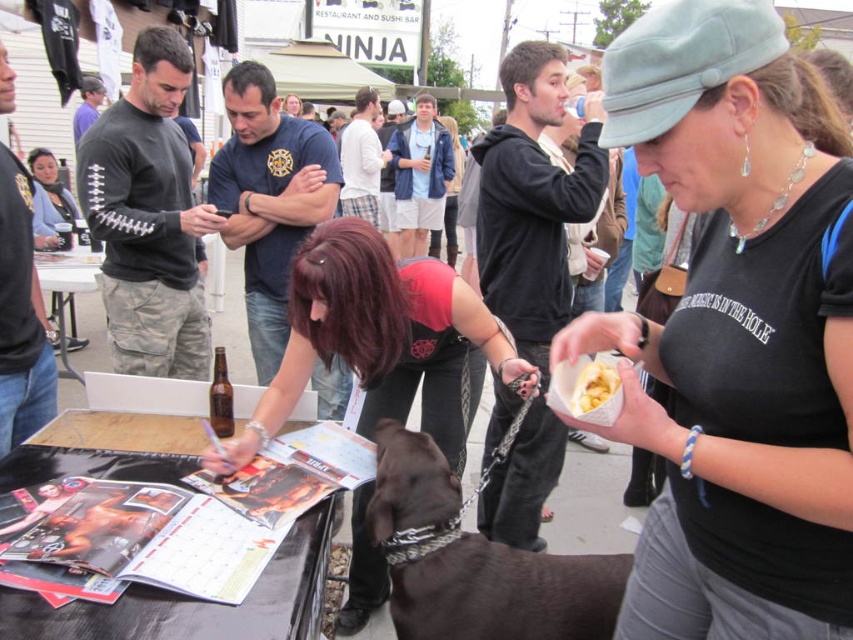
Which is in front, point (810, 182) or point (427, 312)?

Point (810, 182) is in front.

Which of these two, matte black shirt at center or shiny black shirt at center, stands taller?

shiny black shirt at center

Locate an element on the screen. matte black shirt at center is located at coordinates (737, 332).

Where is `matte black shirt at center`? The height and width of the screenshot is (640, 853). matte black shirt at center is located at coordinates (737, 332).

Between point (776, 404) and point (399, 436), which one is positioned in front?

Point (776, 404) is in front.

Is point (735, 413) positioned behind point (482, 600)?

No.

Where is `matte black shirt at center`? matte black shirt at center is located at coordinates (737, 332).

Is shiny black shirt at center taller than yellow crumbly food at center?

Correct, shiny black shirt at center is much taller as yellow crumbly food at center.

Between shiny black shirt at center and yellow crumbly food at center, which one is positioned lower?

Positioned lower is shiny black shirt at center.

Image resolution: width=853 pixels, height=640 pixels. I want to click on shiny black shirt at center, so click(381, 340).